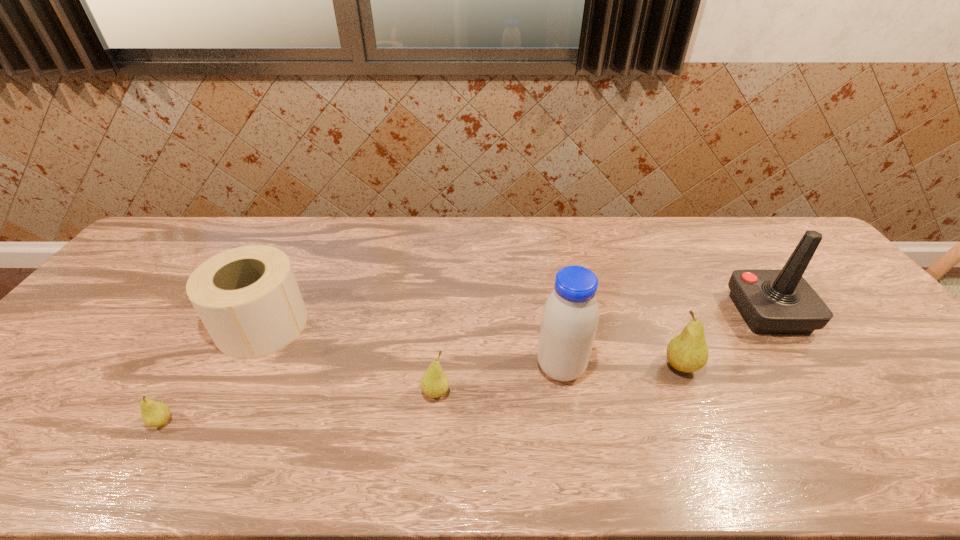
Where is `the shortest object`? Image resolution: width=960 pixels, height=540 pixels. the shortest object is located at coordinates (153, 413).

This screenshot has height=540, width=960. In order to click on the shortest pear in this screenshot , I will do click(x=153, y=413).

Locate an element on the screen. The height and width of the screenshot is (540, 960). the fifth tallest object is located at coordinates pyautogui.click(x=434, y=383).

Identify the location of the second tallest pear. (434, 383).

What are the coordinates of `the rightmost pear` in the screenshot? It's located at (687, 352).

You are a GUI agent. You are given a task and a screenshot of the screen. Output one action in this format:
    pyautogui.click(x=<x>, y=<y>)
    Task: Click on the second object from right to left
    
    Given the screenshot: What is the action you would take?
    pyautogui.click(x=687, y=352)

Find the location of a particular element. The height and width of the screenshot is (540, 960). toilet tissue is located at coordinates (248, 299).

Find the location of a particular element. The width and height of the screenshot is (960, 540). joystick is located at coordinates (770, 301).

Where is `soya milk`? soya milk is located at coordinates (570, 316).

This screenshot has height=540, width=960. Find the location of `vacant space located 0.240m on the right of the leftmost pear`. vacant space located 0.240m on the right of the leftmost pear is located at coordinates (281, 422).